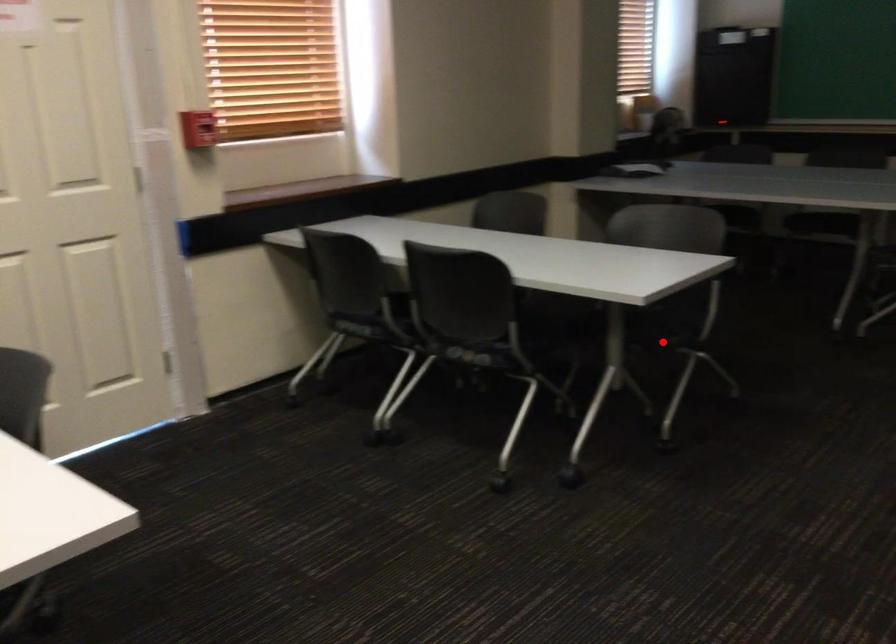
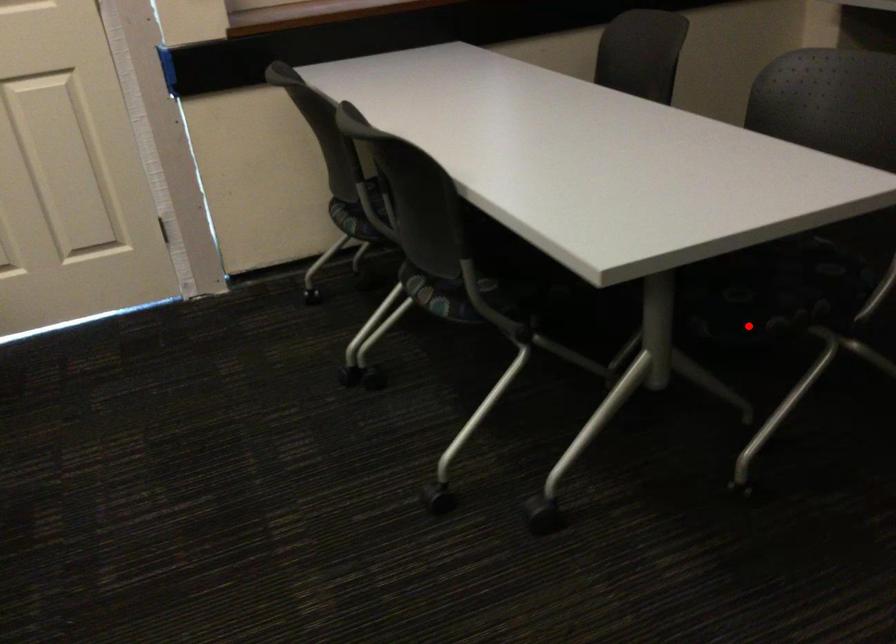
I am providing you with two images of the same scene from different viewpoints. A red point is marked on the first image and another point is marked on the second image. Does the point marked in image1 correspond to the same location as the one in image2?

Yes